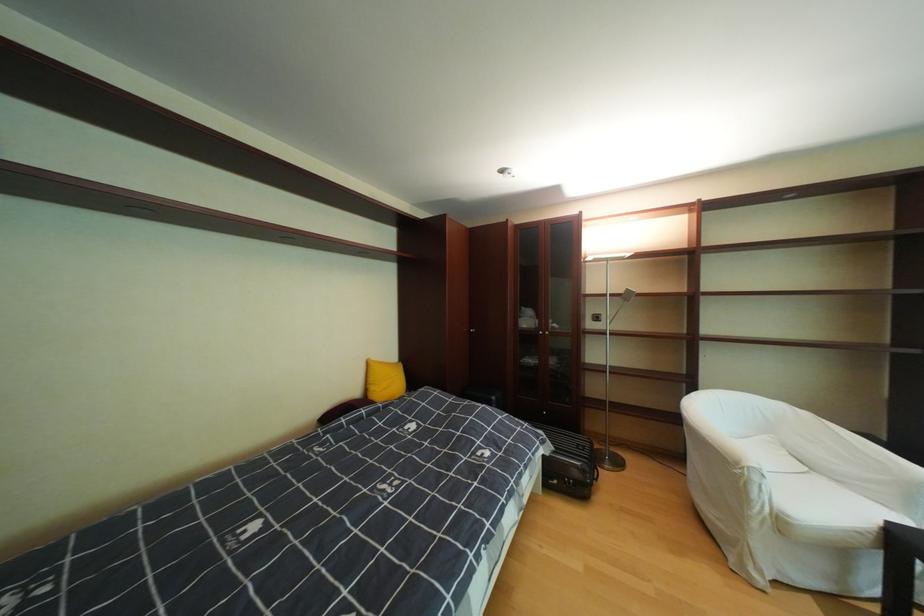
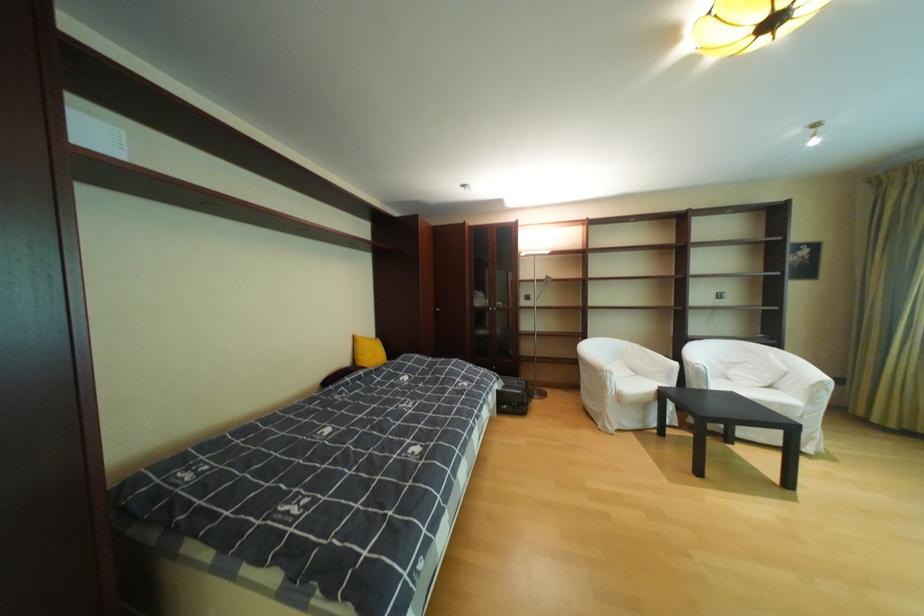
Locate, in the second image, the point that corresponds to (767,525) in the first image.

(621, 402)